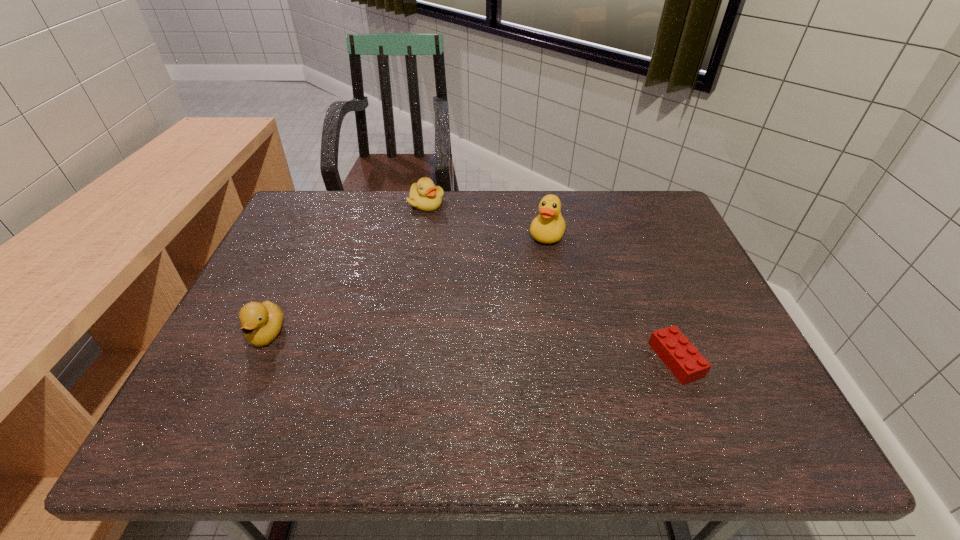
The height and width of the screenshot is (540, 960). I want to click on vacant space on the desktop that is between the left duckling and the rightmost object and is positioned at the beak of the second object from right to left, so click(x=500, y=349).

Locate an element on the screen. The height and width of the screenshot is (540, 960). vacant space on the desktop that is between the leftmost object and the Lego and is positioned on the front-facing side of the right duckling is located at coordinates (434, 345).